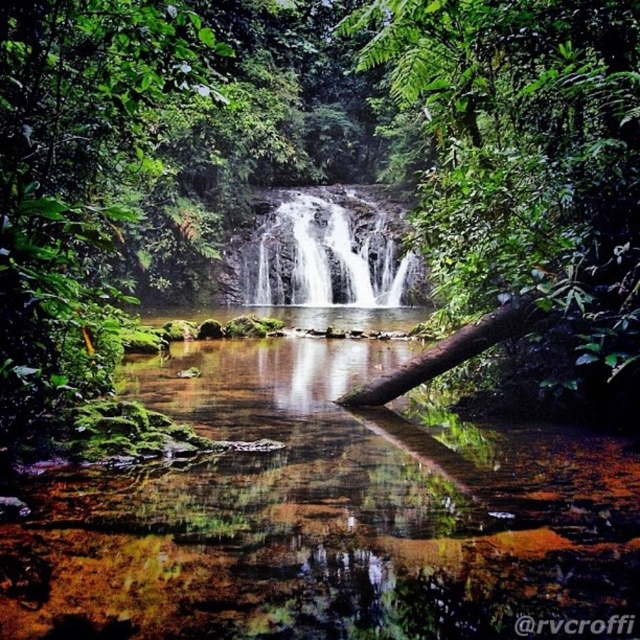
Is green rough log at center wider than white smooth waterfall at center?

No.

Who is shorter, green rough log at center or white smooth waterfall at center?

With less height is white smooth waterfall at center.

The height and width of the screenshot is (640, 640). What do you see at coordinates (522, 173) in the screenshot?
I see `green rough log at center` at bounding box center [522, 173].

Find the location of a particular element. This screenshot has width=640, height=640. green rough log at center is located at coordinates (522, 173).

Does white smooth waterfall at center have a smaller size compared to brown rough log at center?

No, white smooth waterfall at center is not smaller than brown rough log at center.

Is white smooth waterfall at center taller than brown rough log at center?

Yes, white smooth waterfall at center is taller than brown rough log at center.

Between point (376, 294) and point (417, 358), which one is positioned in front?

Point (417, 358) is in front.

Image resolution: width=640 pixels, height=640 pixels. I want to click on white smooth waterfall at center, so click(x=326, y=253).

Based on the photo, is green rough log at center to the right of brown rough log at center from the viewer's perspective?

Yes, green rough log at center is to the right of brown rough log at center.

Between green rough log at center and brown rough log at center, which one is positioned higher?

green rough log at center is above.

You are a GUI agent. You are given a task and a screenshot of the screen. Output one action in this format:
    pyautogui.click(x=<x>, y=<y>)
    Task: Click on the green rough log at center
    
    Given the screenshot: What is the action you would take?
    pyautogui.click(x=522, y=173)